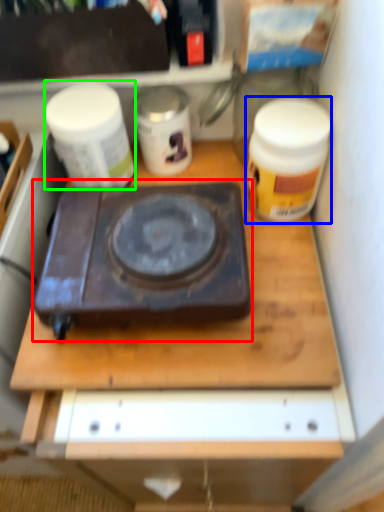
Question: Based on their relative distances, which object is farther from gas stove (highlighted by a red box)? Choose from kitchen appliance (highlighted by a blue box) and yoghurt (highlighted by a green box).

Choices:
 (A) kitchen appliance
 (B) yoghurt

Answer: (A)